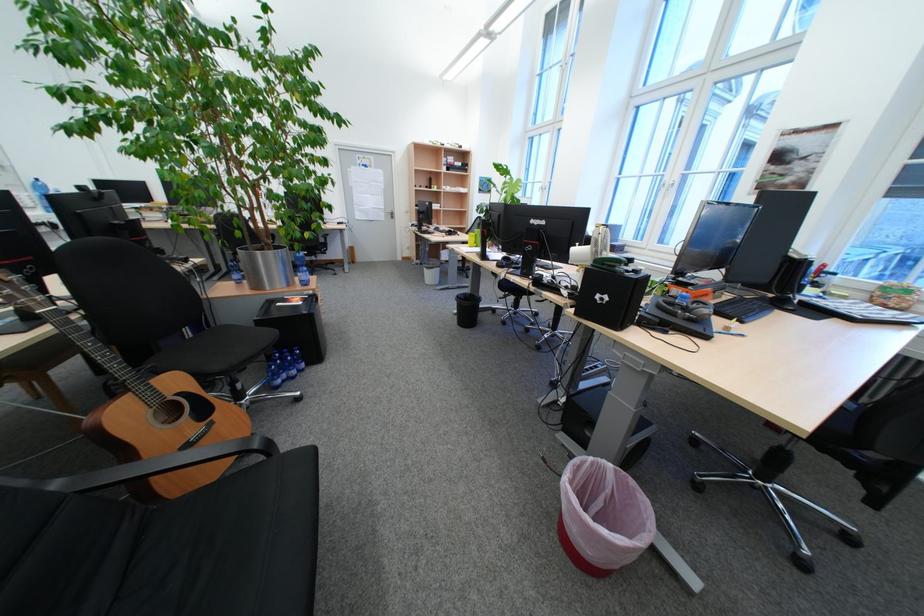
Where would you sit the black chair sitting surface? Please return your answer as a coordinate pair (x, y).

(222, 341)